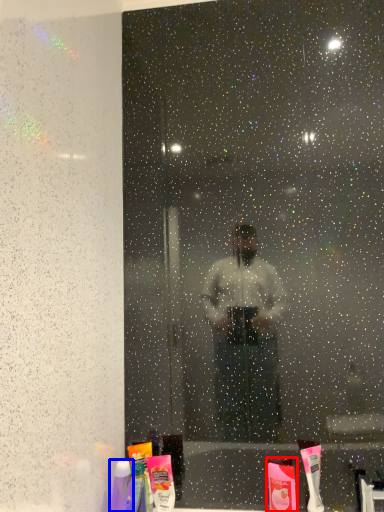
Question: Which of the following is the farthest to the observer, toiletry (highlighted by a red box) or toiletry (highlighted by a blue box)?

Choices:
 (A) toiletry
 (B) toiletry

Answer: (A)